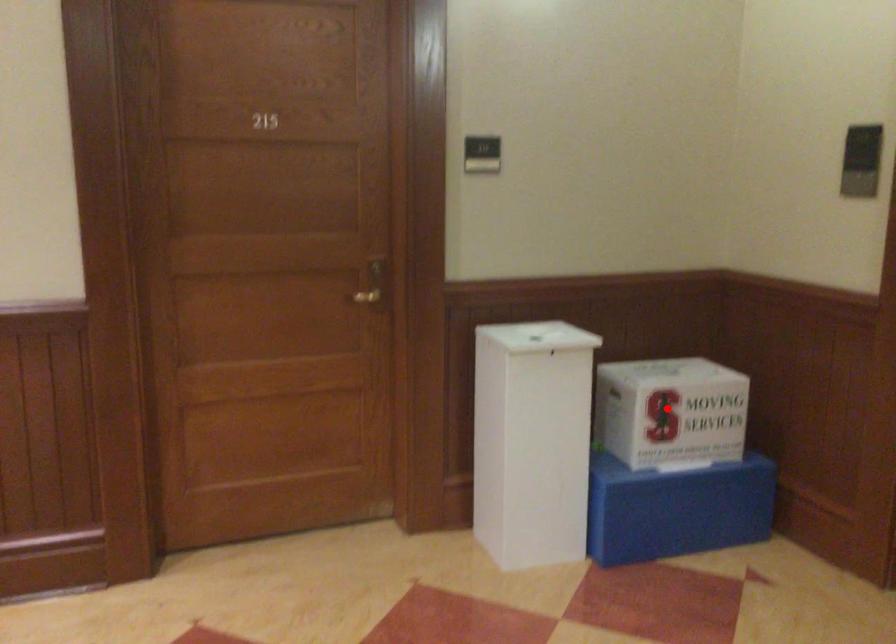
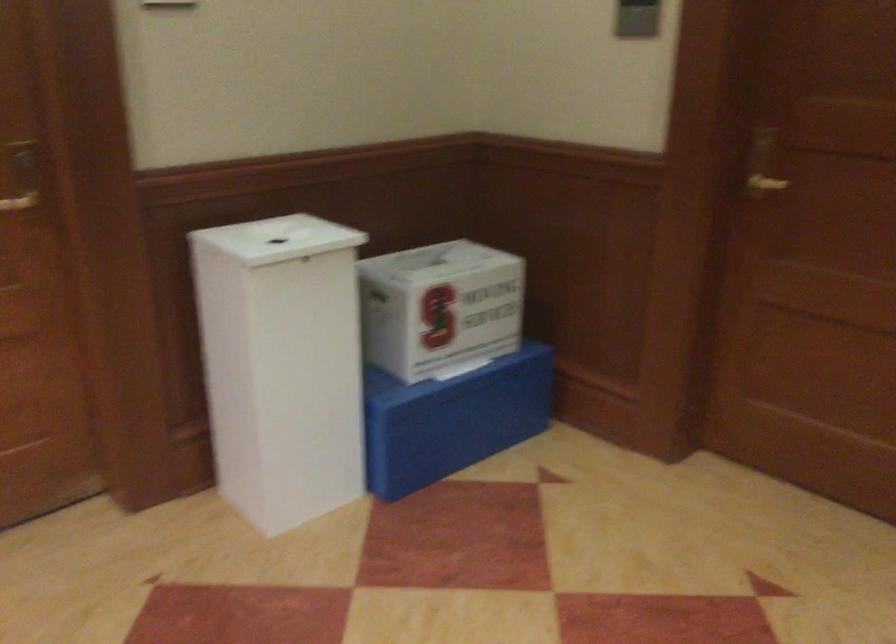
The point at the highlighted location is marked in the first image. Where is the corresponding point in the second image?

(440, 307)